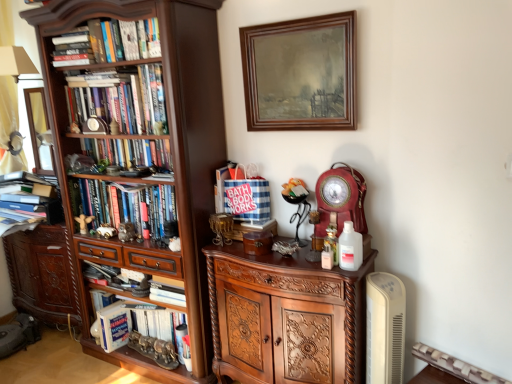
Question: Is metallic silver radiator at lower right not near dark wood bookcase at left?

Choices:
 (A) no
 (B) yes

Answer: (B)

Question: Is metallic silver radiator at lower right wider than dark wood bookcase at left?

Choices:
 (A) no
 (B) yes

Answer: (A)

Question: From a real-world perspective, is metallic silver radiator at lower right on dark wood bookcase at left?

Choices:
 (A) no
 (B) yes

Answer: (A)

Question: Considering the relative sizes of metallic silver radiator at lower right and dark wood bookcase at left in the image provided, is metallic silver radiator at lower right taller than dark wood bookcase at left?

Choices:
 (A) no
 (B) yes

Answer: (A)

Question: Is metallic silver radiator at lower right thinner than dark wood bookcase at left?

Choices:
 (A) no
 (B) yes

Answer: (B)

Question: From a real-world perspective, is metallic silver radiator at lower right under dark wood bookcase at left?

Choices:
 (A) no
 (B) yes

Answer: (B)

Question: Is hardcover book at lower left, the 5th book from the top, bigger than matte red clock at center-right?

Choices:
 (A) no
 (B) yes

Answer: (B)

Question: Can matte red clock at center-right be found inside hardcover book at lower left, which is counted as the first book, starting from the bottom?

Choices:
 (A) yes
 (B) no

Answer: (B)

Question: Can you confirm if hardcover book at lower left, which is counted as the first book, starting from the bottom, is positioned to the left of matte red clock at center-right?

Choices:
 (A) yes
 (B) no

Answer: (A)

Question: Can you confirm if hardcover book at lower left, the 5th book from the top, is wider than matte red clock at center-right?

Choices:
 (A) no
 (B) yes

Answer: (B)

Question: Does hardcover book at lower left, which is counted as the first book, starting from the bottom, appear on the right side of matte red clock at center-right?

Choices:
 (A) no
 (B) yes

Answer: (A)

Question: From the image's perspective, is hardcover book at lower left, which is counted as the first book, starting from the bottom, located above matte red clock at center-right?

Choices:
 (A) yes
 (B) no

Answer: (B)

Question: From the image's perspective, does hardcover books at left, the 2th book when ordered from top to bottom, appear higher than wooden picture frame at upper center?

Choices:
 (A) yes
 (B) no

Answer: (B)